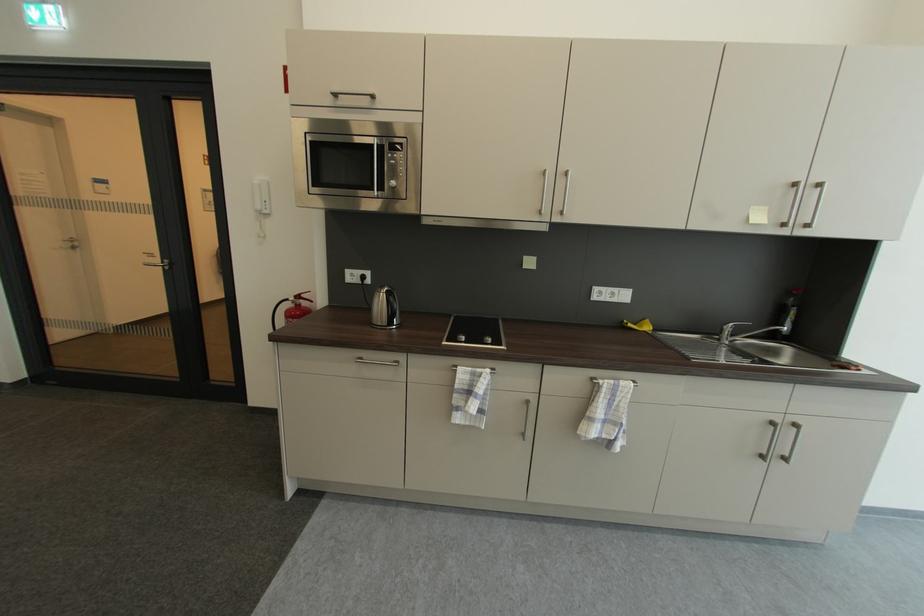
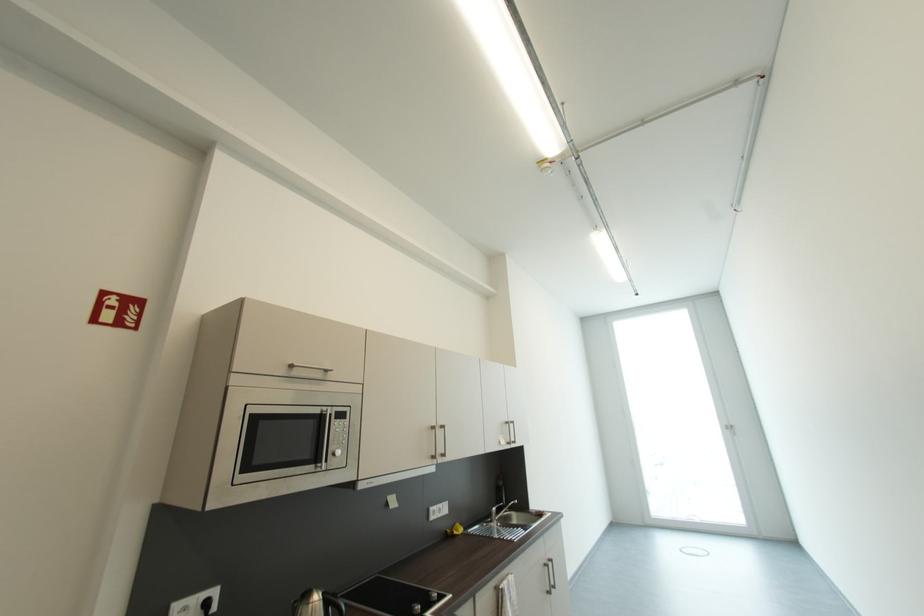
In the second image, find the point that corresponds to pixel 370 278 in the first image.

(213, 605)